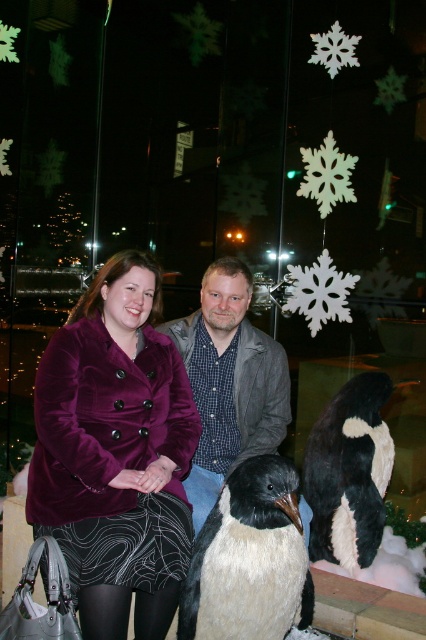
Is white soft penguin at center above black and white fur penguin at lower center?

Incorrect, white soft penguin at center is not positioned above black and white fur penguin at lower center.

Can you confirm if white soft penguin at center is positioned to the right of black and white fur penguin at lower center?

Incorrect, white soft penguin at center is not on the right side of black and white fur penguin at lower center.

The image size is (426, 640). Describe the element at coordinates (249, 557) in the screenshot. I see `white soft penguin at center` at that location.

This screenshot has height=640, width=426. What are the coordinates of `white soft penguin at center` in the screenshot? It's located at (249, 557).

Can you confirm if velvet purple coat at center is smaller than white soft penguin at center?

Actually, velvet purple coat at center might be larger than white soft penguin at center.

Measure the distance from velvet purple coat at center to white soft penguin at center.

velvet purple coat at center is 13.83 inches away from white soft penguin at center.

At what (x,y) coordinates should I click in order to perform the action: click on velvet purple coat at center. Please return your answer as a coordinate pair (x, y). The width and height of the screenshot is (426, 640). Looking at the image, I should click on [x=115, y=452].

Where is `velvet purple coat at center`? The width and height of the screenshot is (426, 640). velvet purple coat at center is located at coordinates (115, 452).

Is point (250, 564) positioned after point (236, 316)?

No, it is in front of (236, 316).

Can you confirm if white soft penguin at center is smaller than velvet gray jacket at center?

Yes, white soft penguin at center is smaller than velvet gray jacket at center.

I want to click on white soft penguin at center, so click(249, 557).